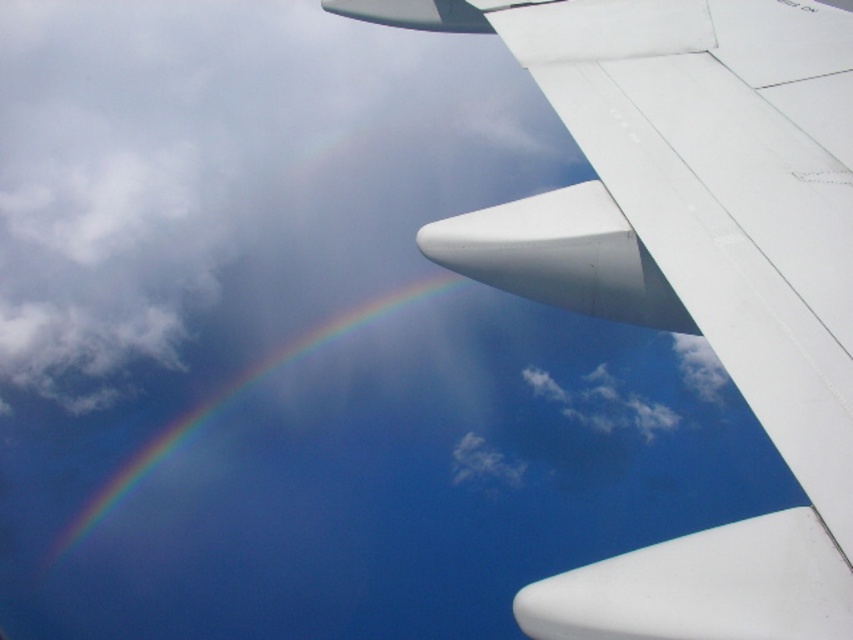
This screenshot has height=640, width=853. What do you see at coordinates (691, 269) in the screenshot?
I see `white matte airplane wing at upper right` at bounding box center [691, 269].

Is white matte airplane wing at upper right to the right of rainbow at upper left from the viewer's perspective?

Correct, you'll find white matte airplane wing at upper right to the right of rainbow at upper left.

Is point (654, 584) positioned behind point (300, 340)?

No, it is in front of (300, 340).

You are a GUI agent. You are given a task and a screenshot of the screen. Output one action in this format:
    pyautogui.click(x=<x>, y=<y>)
    Task: Click on the white matte airplane wing at upper right
    This screenshot has width=853, height=640.
    Given the screenshot: What is the action you would take?
    pyautogui.click(x=691, y=269)